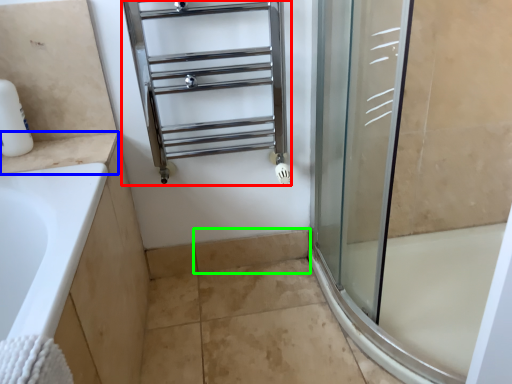
Question: Which object is positioned closest to shelf (highlighted by a red box)? Select from counter top (highlighted by a blue box) and tile (highlighted by a green box).

Choices:
 (A) counter top
 (B) tile

Answer: (A)